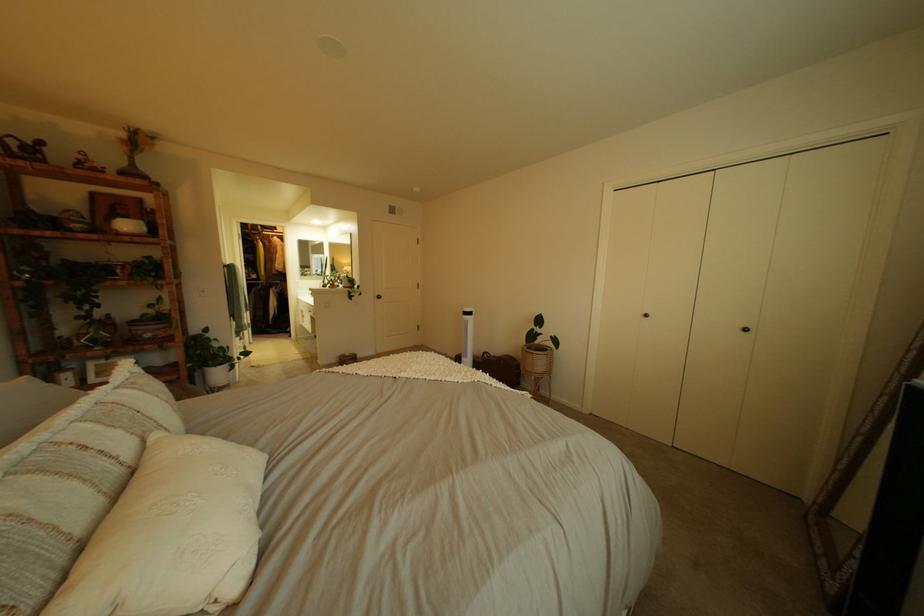
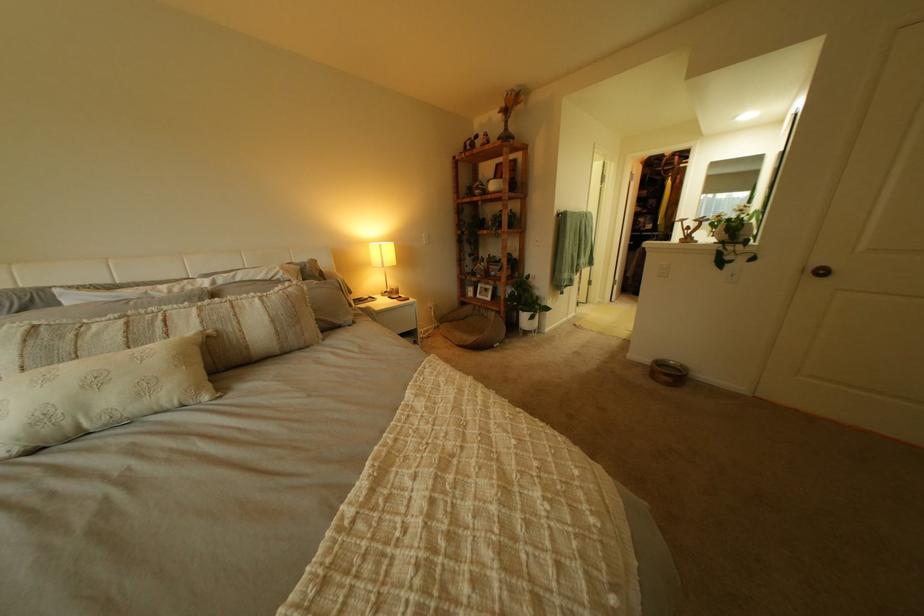
Find the pixel in the second image that matches point 134,434 in the first image.

(213, 323)